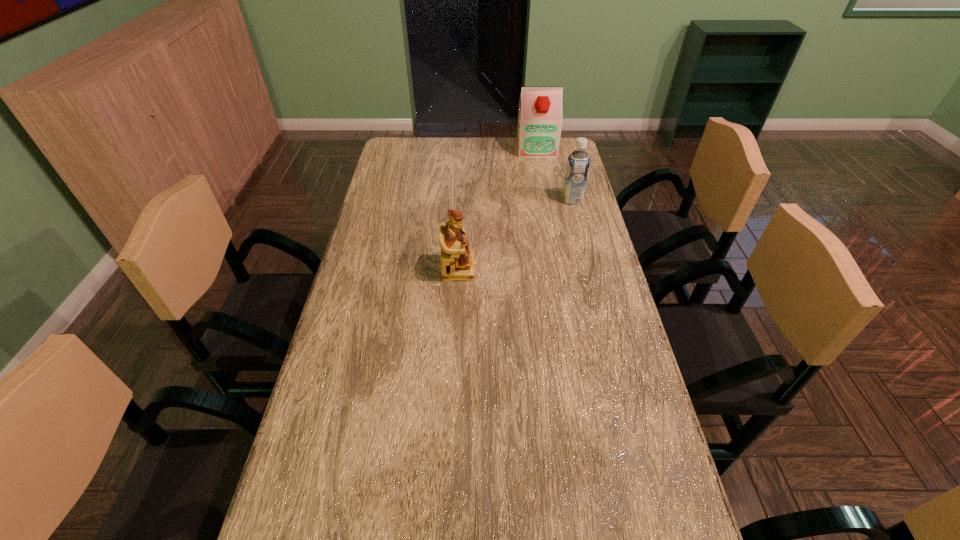
At what (x,y) coordinates should I click in order to perform the action: click on object that is positioned at the far right corner. Please return your answer as a coordinate pair (x, y). The height and width of the screenshot is (540, 960). Looking at the image, I should click on (539, 125).

Locate an element on the screen. This screenshot has height=540, width=960. free location at the far edge is located at coordinates (488, 163).

Locate an element on the screen. This screenshot has width=960, height=540. vacant space at the left edge is located at coordinates (318, 404).

The width and height of the screenshot is (960, 540). Identify the location of vacant space at the right edge of the desktop. (557, 179).

Where is `vacant space at the far left corner`? The height and width of the screenshot is (540, 960). vacant space at the far left corner is located at coordinates (420, 141).

You are a GUI agent. You are given a task and a screenshot of the screen. Output one action in this format:
    pyautogui.click(x=<x>, y=<y>)
    Task: Click on the free space at the far right corner
    This screenshot has height=540, width=960.
    Given the screenshot: What is the action you would take?
    pyautogui.click(x=560, y=161)

Where is `free space that is in between the nearest object and the farther soya milk`? free space that is in between the nearest object and the farther soya milk is located at coordinates (497, 208).

Locate an element on the screen. The width and height of the screenshot is (960, 540). free space between the nearer soya milk and the leftmost object is located at coordinates (516, 234).

The width and height of the screenshot is (960, 540). What are the coordinates of `object that is the second closest to the farther soya milk` in the screenshot? It's located at (457, 261).

Locate which object is the closest to the second farthest object. Please provide its 2D coordinates. Your answer should be formatted as a tuple, i.e. [(x, y)], where the tuple contains the x and y coordinates of a point satisfying the conditions above.

[(539, 125)]